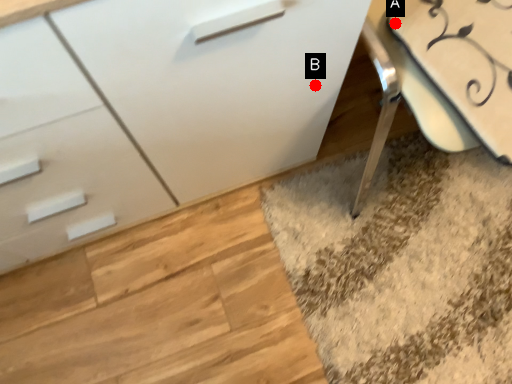
Question: Two points are circled on the image, labeled by A and B beside each circle. Which point is closer to the camera?

Choices:
 (A) A is closer
 (B) B is closer

Answer: (A)